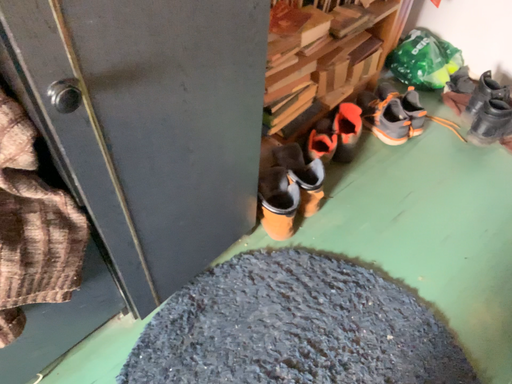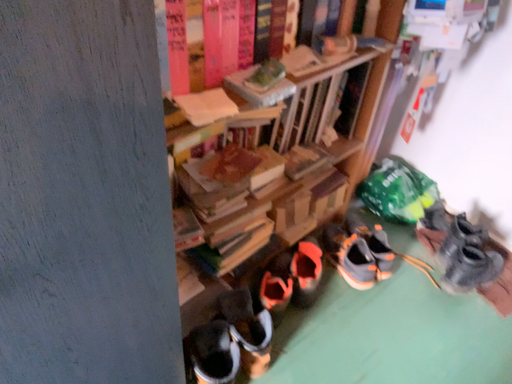
Question: How did the camera likely rotate when shooting the video?

Choices:
 (A) rotated downward
 (B) rotated upward

Answer: (B)